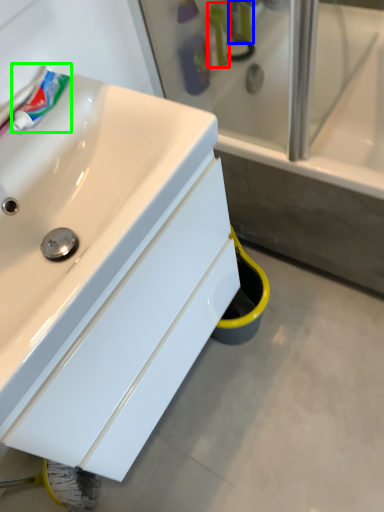
Question: Which object is positioned farthest from mouthwash (highlighted by a red box)? Select from toiletry (highlighted by a blue box) and toothpaste (highlighted by a green box).

Choices:
 (A) toiletry
 (B) toothpaste

Answer: (B)